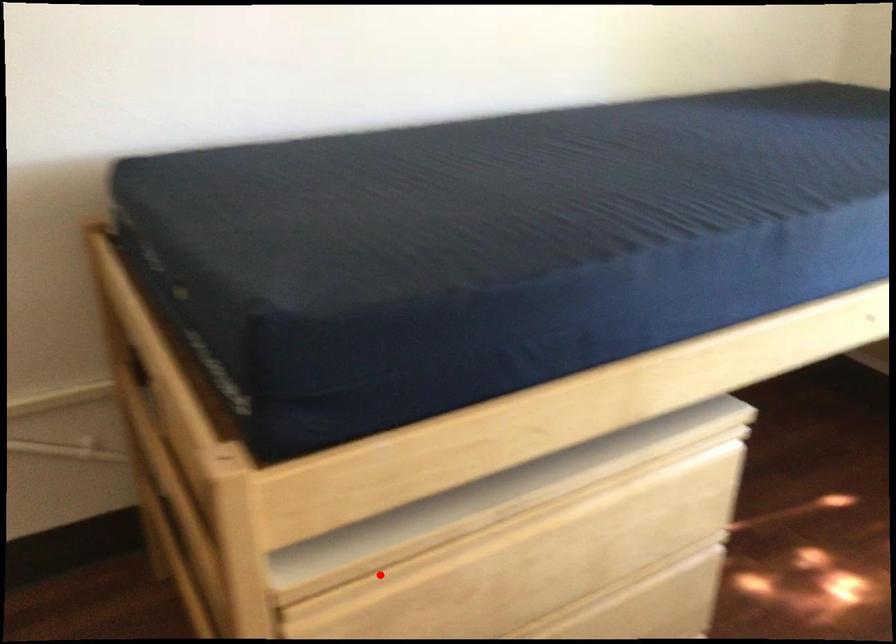
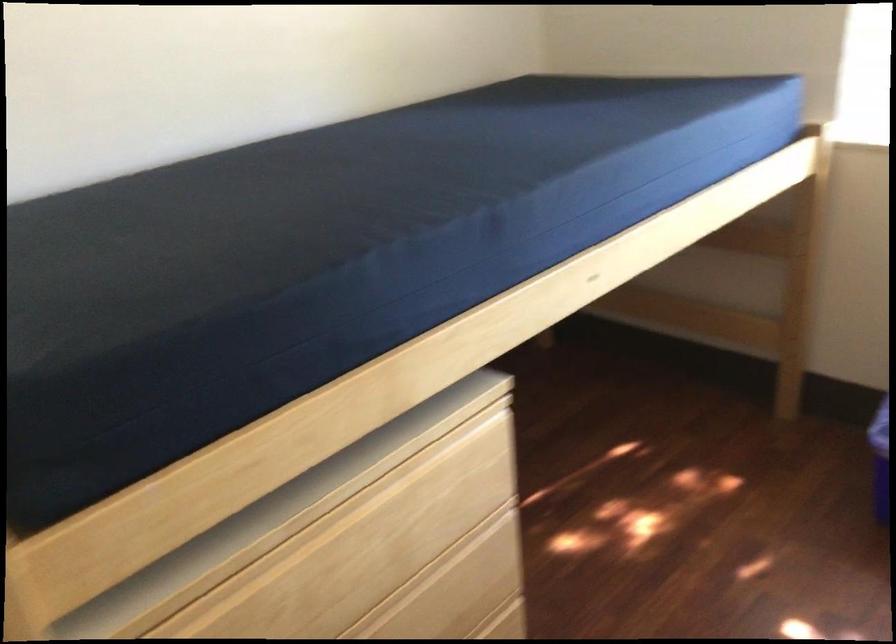
Locate, in the second image, the point that corresponds to the highlighted location in the first image.

(186, 611)